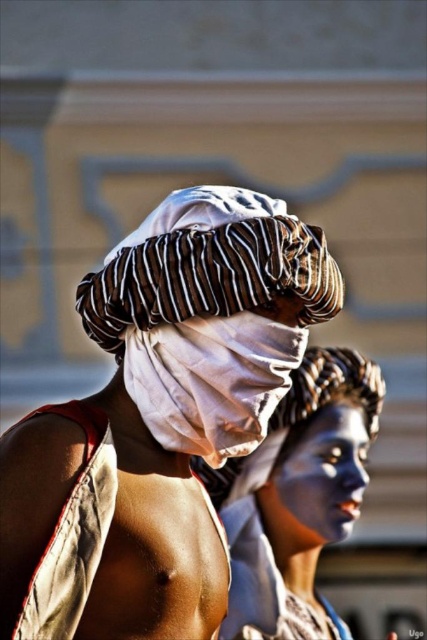
Question: Estimate the real-world distances between objects in this image. Which object is closer to the white cotton headscarf at center?

Choices:
 (A) white cloth at center
 (B) blue matte face at center
 (C) blue matte face paint at center

Answer: (A)

Question: Does white cotton headscarf at center have a lesser width compared to blue matte face paint at center?

Choices:
 (A) yes
 (B) no

Answer: (A)

Question: Based on their relative distances, which object is nearer to the white cloth at center?

Choices:
 (A) blue matte face paint at center
 (B) blue matte face at center
 (C) white cotton headscarf at center

Answer: (C)

Question: Does blue matte face paint at center have a smaller size compared to blue matte face at center?

Choices:
 (A) no
 (B) yes

Answer: (A)

Question: Can you confirm if white cotton headscarf at center is positioned above blue matte face at center?

Choices:
 (A) no
 (B) yes

Answer: (B)

Question: Among these points, which one is farthest from the camera?

Choices:
 (A) (137, 308)
 (B) (315, 483)
 (C) (289, 579)
 (D) (257, 298)

Answer: (C)